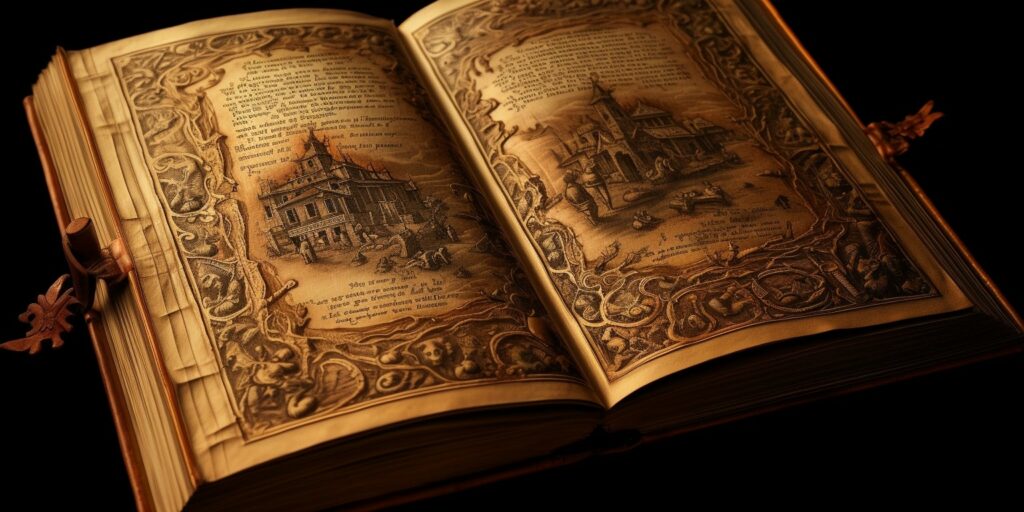
Identify the location of latch. (93, 282).